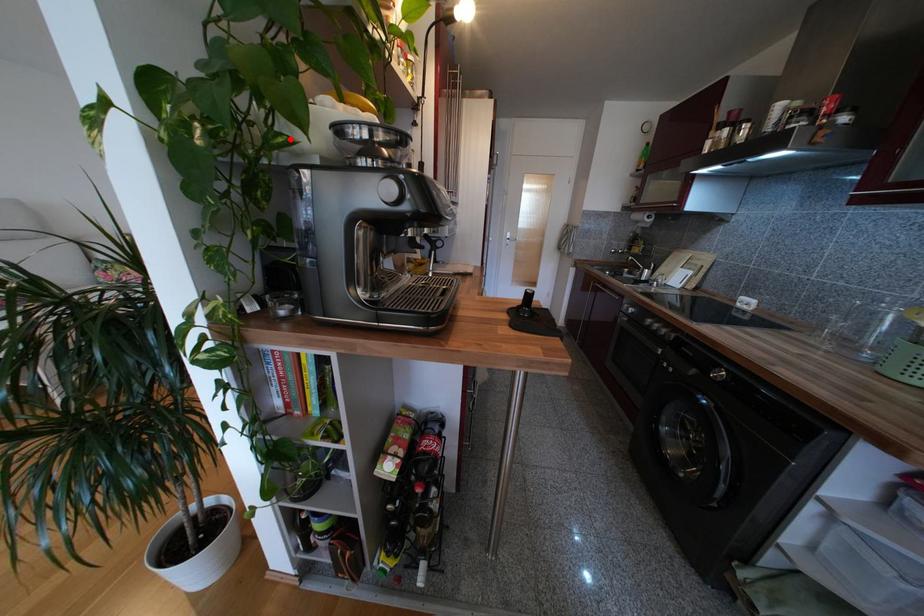
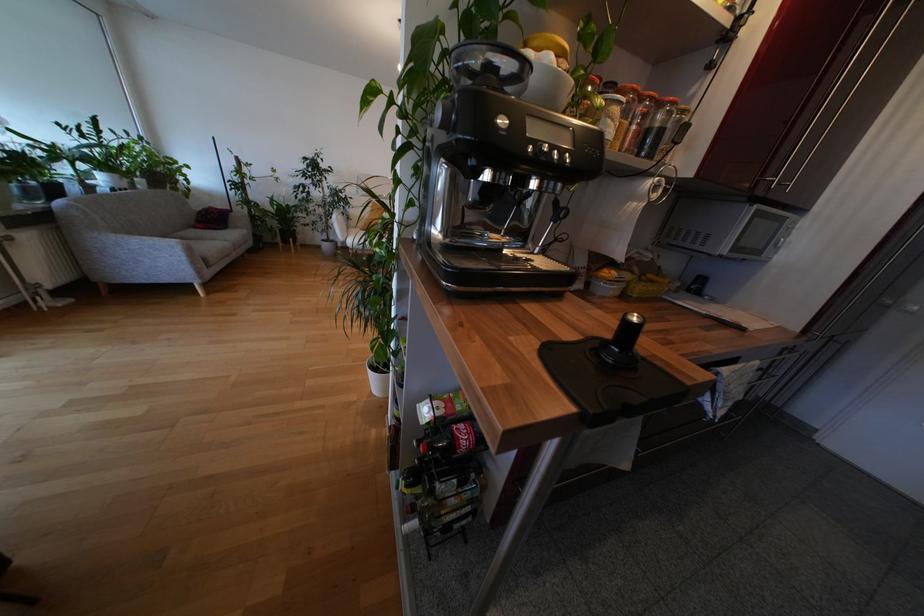
Find the pixel in the second image that matches the highlighted location in the first image.

(450, 95)